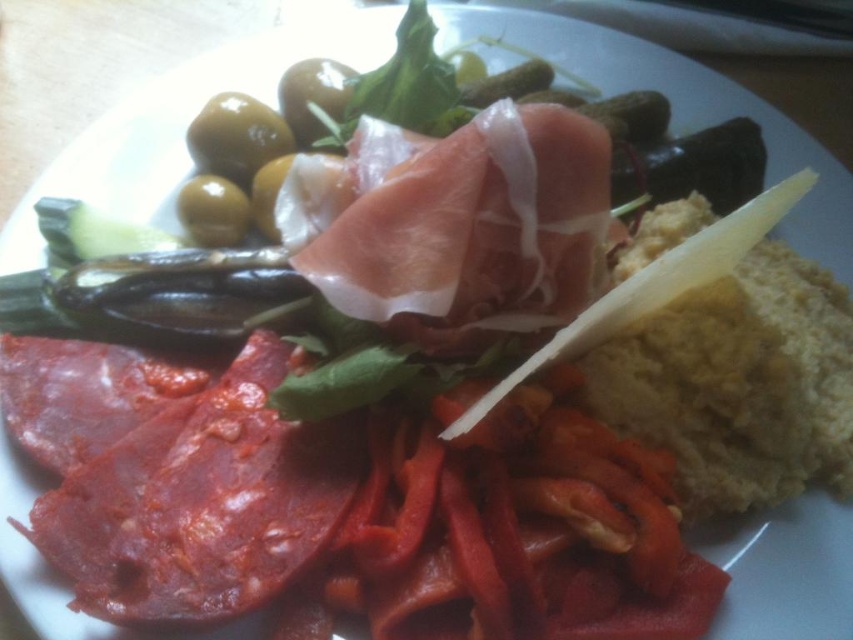
You are looking at the plate and want to pick up the item closest to you. Which point should you reach for, point (x=233, y=468) or point (x=372, y=288)?

Point (x=233, y=468) is closer to the camera than point (x=372, y=288), so you should reach for point (x=233, y=468).